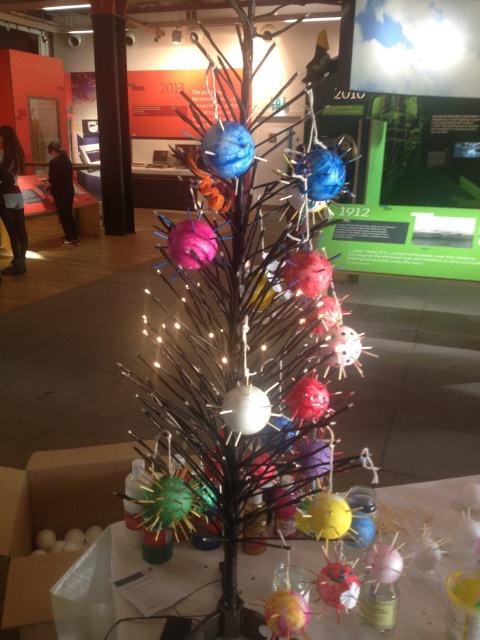
You are an art curator planning to move a large sculpture into the exhibition space. The sculpture requires a clear area of 3 meters in diameter. Considering the metallic wire tree at center and the translucent plastic table at lower center, can the sculpture be placed between them without obstructing either?

The metallic wire tree at center is located above the translucent plastic table at lower center, meaning they occupy the same vertical space. Placing a large sculpture between them would likely interfere with both objects, so it is not advisable.

You are an artist planning to move the translucent plastic table at lower center closer to the metallic wire tree at center. Given the size difference between them, do you think the table will still be visible once moved? Please explain your reasoning based on their sizes.

The metallic wire tree at center is larger in size than the translucent plastic table at lower center. Since the table is smaller and made of translucent material, it might become less noticeable when placed near the larger tree, but its transparency could still allow it to be seen depending on lighting and angles.

You are standing in front of the tree structure and want to reach a specific point on the tree located at coordinates point (307, 189). If your arm can extend 30 inches, can you reach that point?

The point (307, 189) is 35.59 inches from the camera, which is farther than your arm can reach. Therefore, you cannot reach it with your arm.